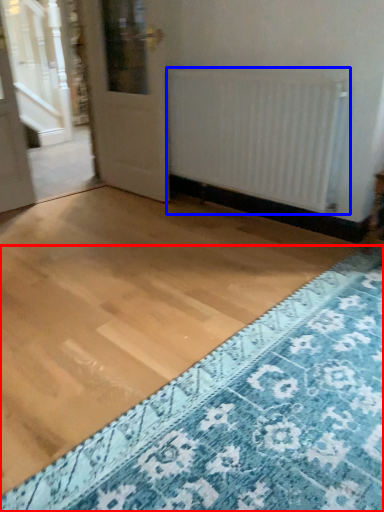
Question: Which of the following is the farthest to the observer, doormat (highlighted by a red box) or radiator (highlighted by a blue box)?

Choices:
 (A) doormat
 (B) radiator

Answer: (B)